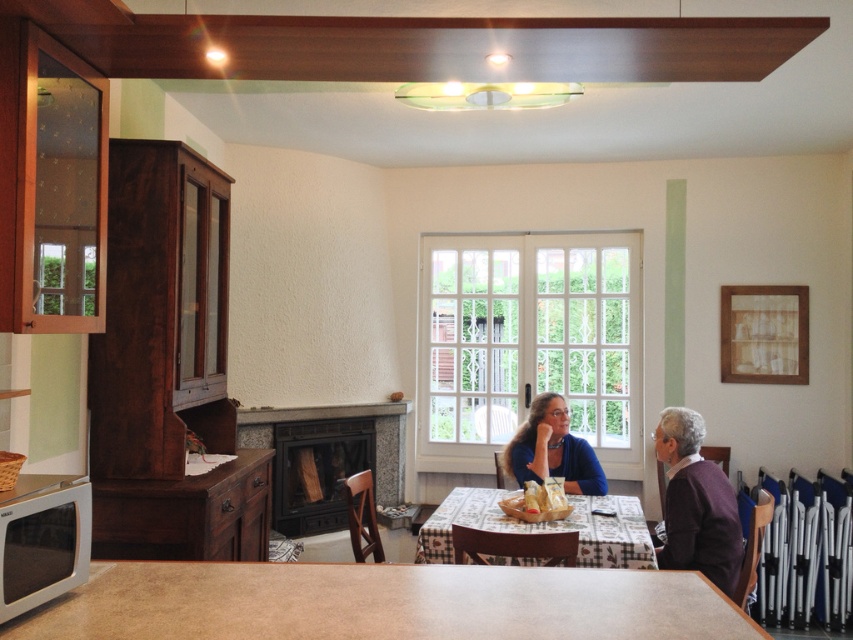
You are organizing a closet and have both the purple wool sweater at right and the shiny plastic bag at table center. Which item is wider?

The purple wool sweater at right is wider than the shiny plastic bag at table center.

You are organizing the dining area and need to place the shiny plastic bag at table center. Where should you put it so it doesn not interfere with the purple wool sweater at right?

The purple wool sweater at right is above the shiny plastic bag at table center, so placing the shiny plastic bag at table center below the purple wool sweater at right would prevent interference.

You are arranging a dinner setting in the dining area. You have a smooth beige table at center and a patterned fabric table at center. Which table should you place the centerpiece on if you want it to be closer to the French doors?

The smooth beige table at center is to the left of the patterned fabric table at center. Since the French doors are on the right side of the room, placing the centerpiece on the patterned fabric table at center would position it closer to the doors.